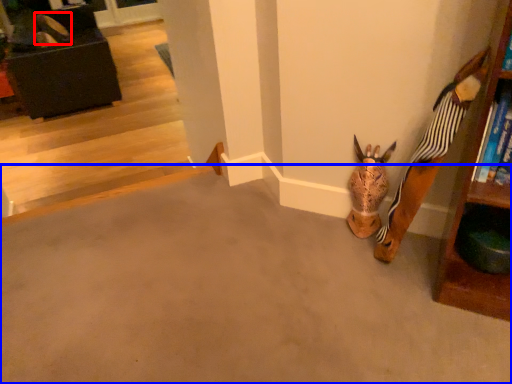
Question: Which object is closer to the camera taking this photo, shoe (highlighted by a red box) or concrete (highlighted by a blue box)?

Choices:
 (A) shoe
 (B) concrete

Answer: (B)